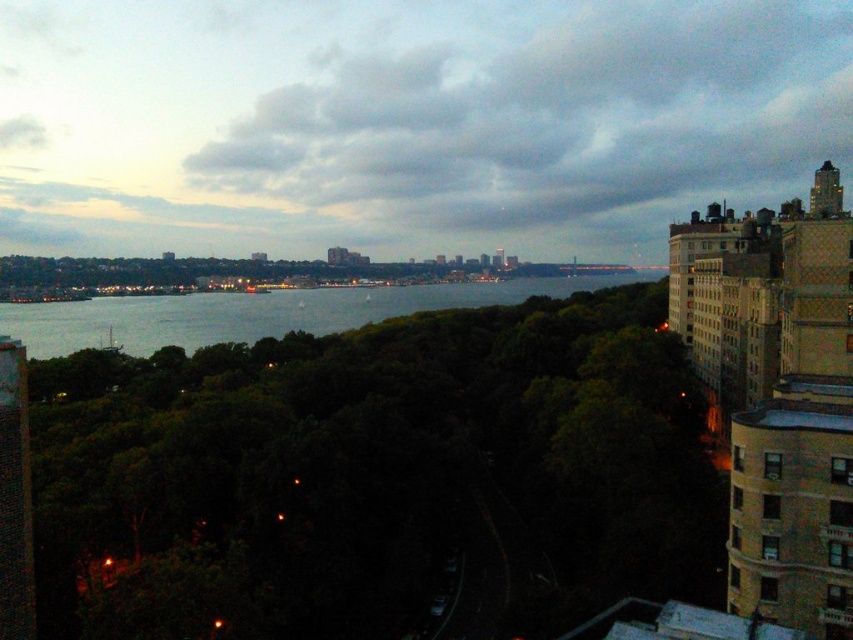
Does point (433, 108) come farther from viewer compared to point (372, 289)?

That is True.

Between cloudy sky at upper center and gray water at center, which one has more height?

cloudy sky at upper center is taller.

The height and width of the screenshot is (640, 853). In order to click on cloudy sky at upper center in this screenshot , I will do `click(407, 120)`.